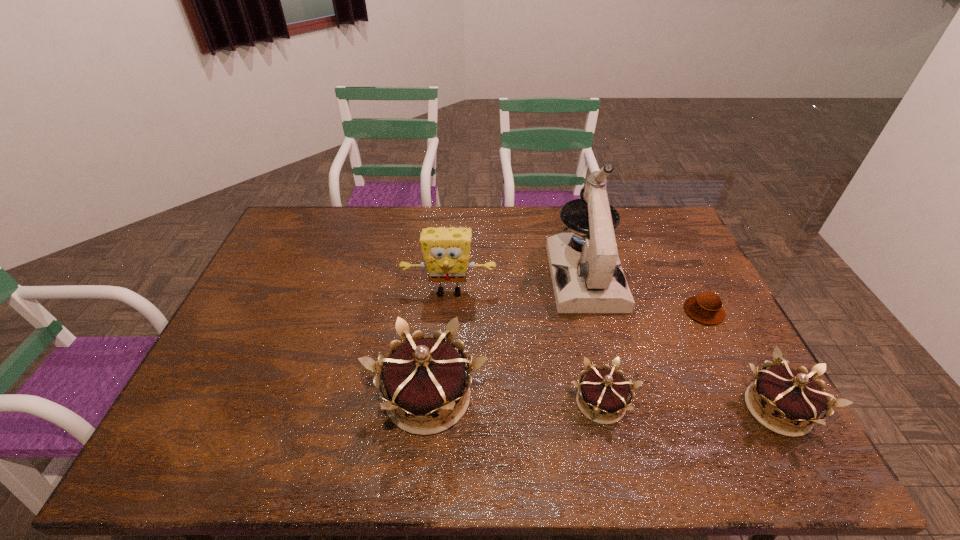
In the current image, all crowns are evenly spaced. To maintain this equal spacing, where should an additional crown be placed on the left? Please point out a free spot. Please provide its 2D coordinates. Your answer should be formatted as a tuple, i.e. [(x, y)], where the tuple contains the x and y coordinates of a point satisfying the conditions above.

[(259, 391)]